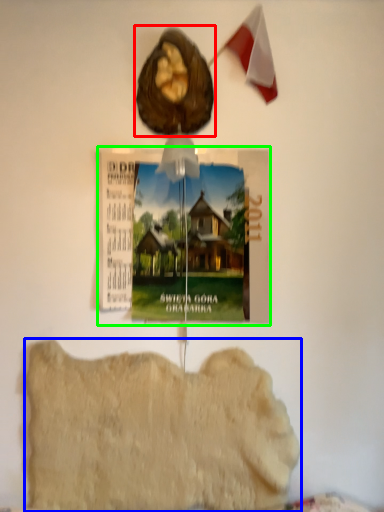
Question: Considering the real-world distances, which object is farthest from animal (highlighted by a red box)? food (highlighted by a blue box) or postcard (highlighted by a green box)?

Choices:
 (A) food
 (B) postcard

Answer: (A)